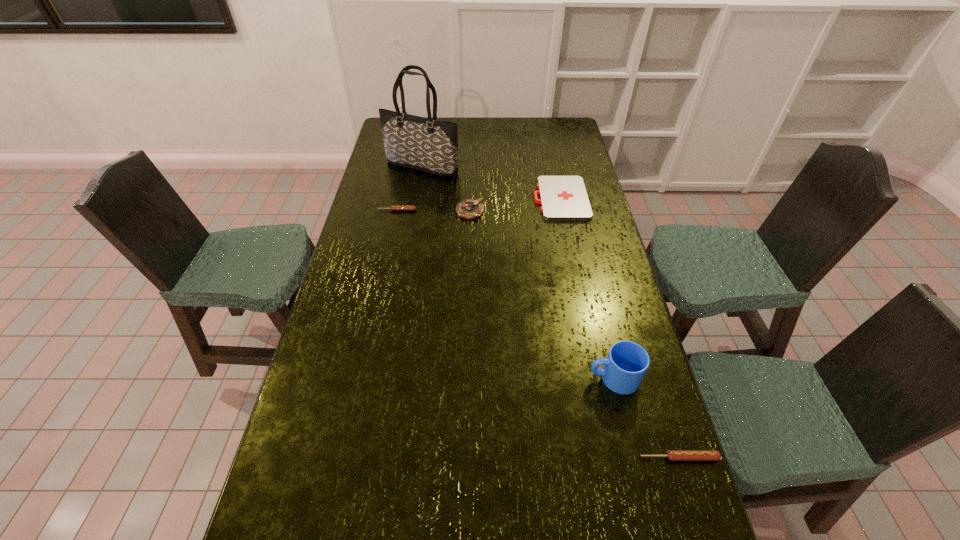
Where is `sausage that is at the left edge`? This screenshot has width=960, height=540. sausage that is at the left edge is located at coordinates (394, 208).

Identify the location of tote bag located in the left edge section of the desktop. (427, 144).

Identify the location of sausage located at the right edge. (673, 455).

This screenshot has height=540, width=960. I want to click on the first-aid kit present at the right edge, so click(x=563, y=198).

Find the location of a particular element. The height and width of the screenshot is (540, 960). mug that is at the right edge is located at coordinates (627, 362).

Where is `free location at the far edge of the desktop`? The height and width of the screenshot is (540, 960). free location at the far edge of the desktop is located at coordinates click(x=465, y=119).

Identify the location of free space at the near edge. Image resolution: width=960 pixels, height=540 pixels. (x=480, y=500).

Where is `vacant area at the left edge`? The width and height of the screenshot is (960, 540). vacant area at the left edge is located at coordinates (379, 239).

This screenshot has width=960, height=540. I want to click on free spot at the right edge of the desktop, so click(x=667, y=460).

Locate an element on the screen. free point at the near right corner is located at coordinates (666, 503).